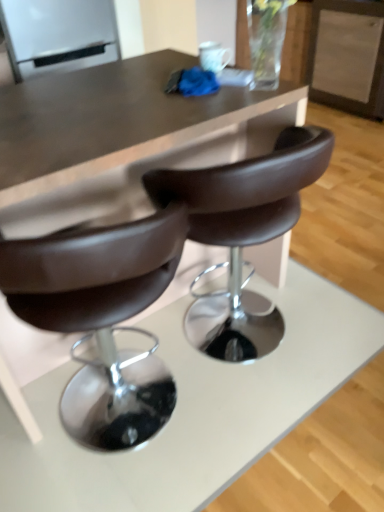
Find the location of a particular element. vacant space in brown leather chair at center (from a real-world perspective) is located at coordinates (247, 344).